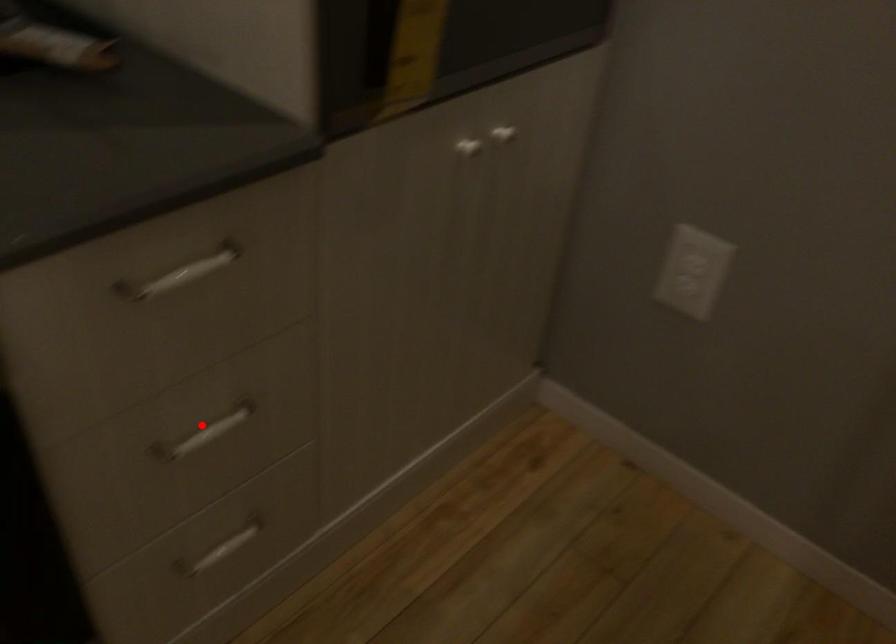
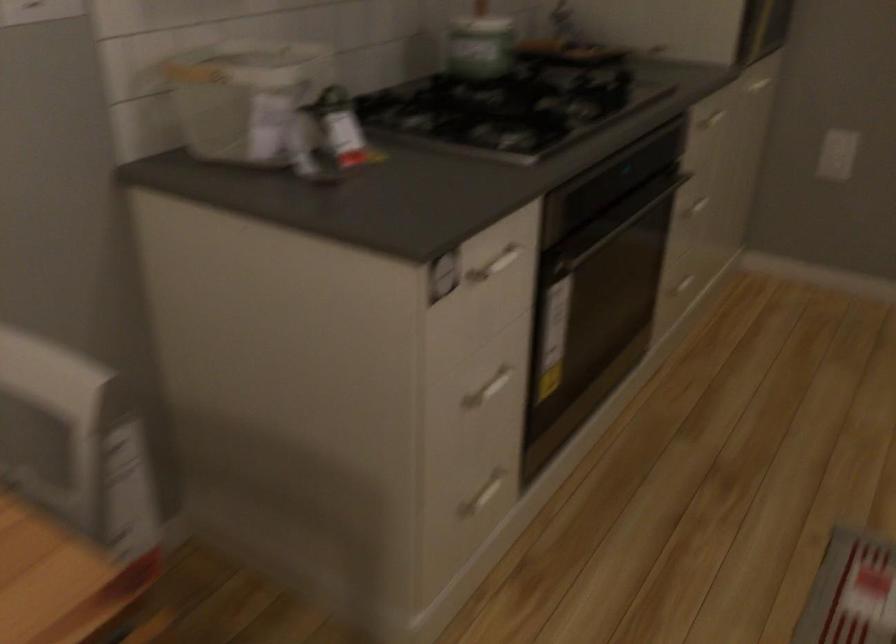
Question: I am providing you with two images of the same scene from different viewpoints. A red point is marked on the first image. At the location where the point appears in image 1, is it still visible in image 2?

Choices:
 (A) Yes
 (B) No

Answer: (A)